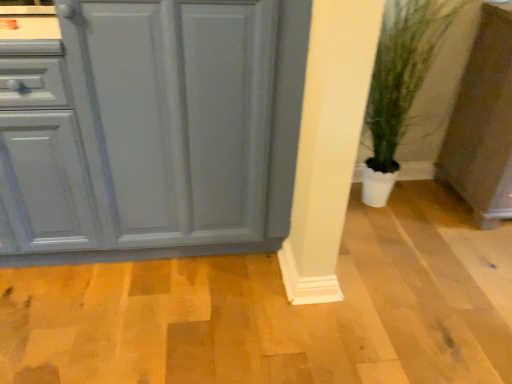
Question: Is matte gray cabinet at lower right, which is the second cabinetry from left to right, to the left of matte gray cabinet at left, which is the 2th cabinetry from right to left, from the viewer's perspective?

Choices:
 (A) yes
 (B) no

Answer: (B)

Question: Considering the relative positions of matte gray cabinet at lower right, which is the 1th cabinetry from right to left, and matte gray cabinet at left, which is the 2th cabinetry from right to left, in the image provided, is matte gray cabinet at lower right, which is the 1th cabinetry from right to left, to the right of matte gray cabinet at left, which is the 2th cabinetry from right to left, from the viewer's perspective?

Choices:
 (A) yes
 (B) no

Answer: (A)

Question: From the image's perspective, is matte gray cabinet at lower right, which is the 1th cabinetry from right to left, beneath matte gray cabinet at left, which is the 2th cabinetry from right to left?

Choices:
 (A) yes
 (B) no

Answer: (B)

Question: Is matte gray cabinet at left, which is the 2th cabinetry from right to left, inside matte gray cabinet at lower right, which is the 1th cabinetry from right to left?

Choices:
 (A) no
 (B) yes

Answer: (A)

Question: Does matte gray cabinet at lower right, which is the second cabinetry from left to right, lie behind matte gray cabinet at left, which is the 2th cabinetry from right to left?

Choices:
 (A) no
 (B) yes

Answer: (B)

Question: In the image, is matte gray cabinet at lower right, which is the 1th cabinetry from right to left, positioned in front of or behind green leafy plant in pot at lower right?

Choices:
 (A) front
 (B) behind

Answer: (B)

Question: Looking at the image, does matte gray cabinet at lower right, which is the second cabinetry from left to right, seem bigger or smaller compared to green leafy plant in pot at lower right?

Choices:
 (A) big
 (B) small

Answer: (A)

Question: Considering the positions of matte gray cabinet at lower right, which is the second cabinetry from left to right, and green leafy plant in pot at lower right in the image, is matte gray cabinet at lower right, which is the second cabinetry from left to right, wider or thinner than green leafy plant in pot at lower right?

Choices:
 (A) thin
 (B) wide

Answer: (B)

Question: Based on their positions, is matte gray cabinet at lower right, which is the 1th cabinetry from right to left, located to the left or right of green leafy plant in pot at lower right?

Choices:
 (A) left
 (B) right

Answer: (B)

Question: From the image's perspective, is green leafy plant in pot at lower right above or below matte gray cabinet at left, which is the 2th cabinetry from right to left?

Choices:
 (A) above
 (B) below

Answer: (A)

Question: Is point (429, 18) closer or farther from the camera than point (125, 44)?

Choices:
 (A) farther
 (B) closer

Answer: (A)

Question: In terms of height, does green leafy plant in pot at lower right look taller or shorter compared to matte gray cabinet at left, which appears as the first cabinetry when viewed from the left?

Choices:
 (A) tall
 (B) short

Answer: (A)

Question: Visually, is green leafy plant in pot at lower right positioned to the left or to the right of matte gray cabinet at left, which is the 2th cabinetry from right to left?

Choices:
 (A) left
 (B) right

Answer: (B)

Question: In the image, is green leafy plant in pot at lower right positioned in front of or behind matte gray cabinet at lower right, which is the 1th cabinetry from right to left?

Choices:
 (A) behind
 (B) front

Answer: (B)

Question: Is green leafy plant in pot at lower right situated inside matte gray cabinet at lower right, which is the 1th cabinetry from right to left, or outside?

Choices:
 (A) inside
 (B) outside

Answer: (B)